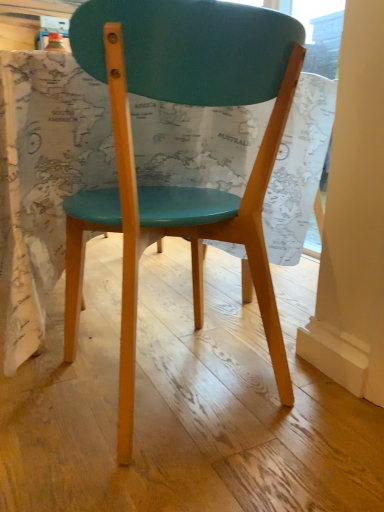
I want to click on vacant point to the left of teal matte wood chair at center, so click(49, 391).